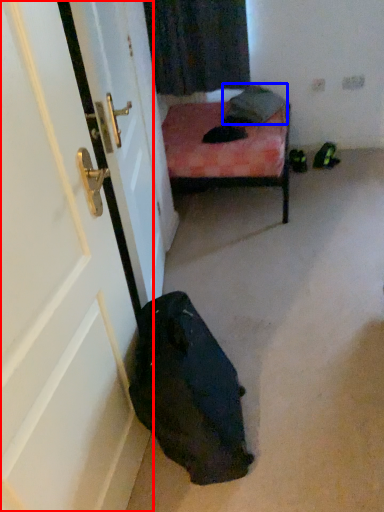
Question: Which object appears farthest to the camera in this image, door (highlighted by a red box) or pillow (highlighted by a blue box)?

Choices:
 (A) door
 (B) pillow

Answer: (B)